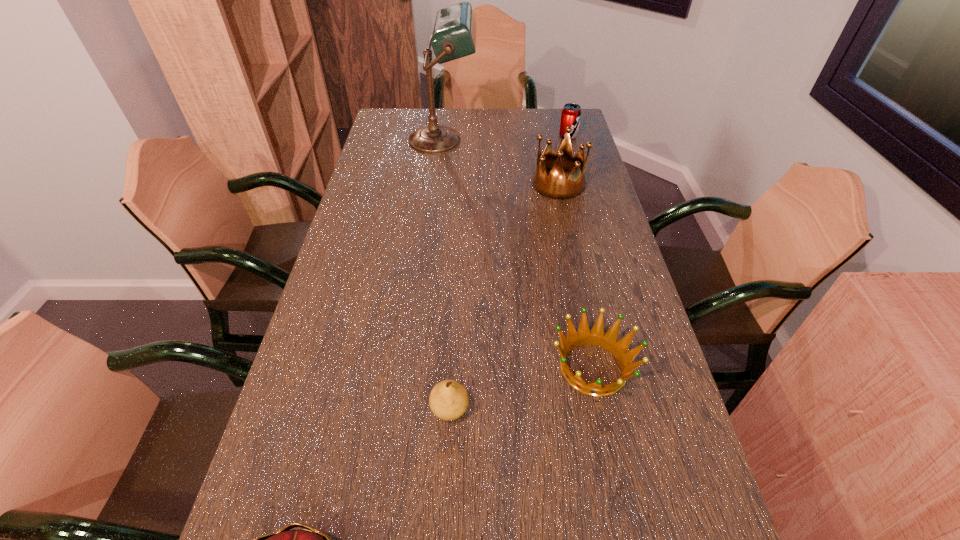
Where is `free space in the image that satisfies the following two spatial constraints: 1. above the green lampshade of the table lamp; 2. on the right side of the fifth shortest object`? free space in the image that satisfies the following two spatial constraints: 1. above the green lampshade of the table lamp; 2. on the right side of the fifth shortest object is located at coordinates (438, 184).

Locate an element on the screen. Image resolution: width=960 pixels, height=540 pixels. free spot that satisfies the following two spatial constraints: 1. above the green lampshade of the pear; 2. on the right side of the table lamp is located at coordinates (412, 409).

Where is `vacant space that satisfies the following two spatial constraints: 1. above the green lampshade of the tallest object; 2. on the right side of the second nearest crown`? The width and height of the screenshot is (960, 540). vacant space that satisfies the following two spatial constraints: 1. above the green lampshade of the tallest object; 2. on the right side of the second nearest crown is located at coordinates (417, 368).

The image size is (960, 540). What are the coordinates of `vacant space that satisfies the following two spatial constraints: 1. above the green lampshade of the table lamp; 2. on the left side of the pear` in the screenshot? It's located at (412, 409).

Image resolution: width=960 pixels, height=540 pixels. I want to click on free spot that satisfies the following two spatial constraints: 1. on the back side of the second farthest crown; 2. on the left side of the farthest crown, so click(x=555, y=184).